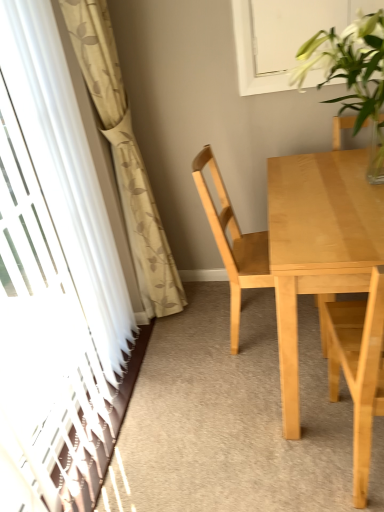
Question: Would you say beige floral curtain at left is to the left or to the right of light wood chair at center, which is the second chair from front to back, in the picture?

Choices:
 (A) right
 (B) left

Answer: (B)

Question: Considering their positions, is beige floral curtain at left located in front of or behind light wood chair at center, which is the second chair from front to back?

Choices:
 (A) behind
 (B) front

Answer: (B)

Question: Which object is positioned closest to the light wood chair at center, marked as the 1th chair in a back-to-front arrangement?

Choices:
 (A) transparent plastic screen door at left
 (B) light wood table at center
 (C) beige floral curtain at left
 (D) clear glass vase at upper right
 (E) light wood chair at right, which appears as the 2th chair when viewed from the back

Answer: (B)

Question: Considering the real-world distances, which object is closest to the light wood chair at right, which appears as the 2th chair when viewed from the back?

Choices:
 (A) beige floral curtain at left
 (B) transparent plastic screen door at left
 (C) clear glass vase at upper right
 (D) light wood chair at center, which is the second chair from front to back
 (E) white glossy window at upper center

Answer: (D)